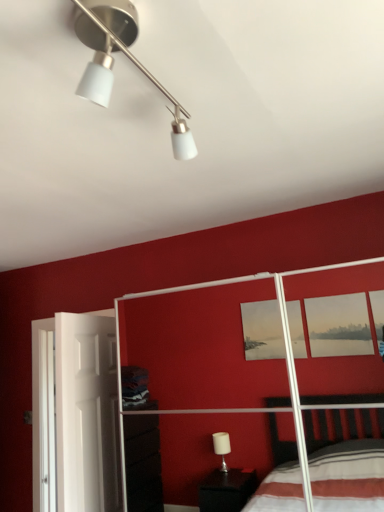
Question: Is matte white bed frame at center smaller than white matte track light at upper center?

Choices:
 (A) yes
 (B) no

Answer: (B)

Question: Is matte white bed frame at center in contact with white matte track light at upper center?

Choices:
 (A) no
 (B) yes

Answer: (A)

Question: Is white matte track light at upper center at the back of matte white bed frame at center?

Choices:
 (A) no
 (B) yes

Answer: (A)

Question: Considering the relative sizes of matte white bed frame at center and white matte track light at upper center in the image provided, is matte white bed frame at center wider than white matte track light at upper center?

Choices:
 (A) yes
 (B) no

Answer: (A)

Question: Considering the relative sizes of matte white bed frame at center and white matte track light at upper center in the image provided, is matte white bed frame at center thinner than white matte track light at upper center?

Choices:
 (A) no
 (B) yes

Answer: (A)

Question: From the image's perspective, is matte white bed frame at center positioned above or below white matte screen door at left?

Choices:
 (A) above
 (B) below

Answer: (A)

Question: Which is correct: matte white bed frame at center is inside white matte screen door at left, or outside of it?

Choices:
 (A) outside
 (B) inside

Answer: (A)

Question: From their relative heights in the image, would you say matte white bed frame at center is taller or shorter than white matte screen door at left?

Choices:
 (A) tall
 (B) short

Answer: (A)

Question: Considering the relative positions of matte white bed frame at center and white matte screen door at left in the image provided, is matte white bed frame at center to the left or to the right of white matte screen door at left?

Choices:
 (A) left
 (B) right

Answer: (B)

Question: Looking at the image, does white matte track light at upper center seem bigger or smaller compared to white matte screen door at left?

Choices:
 (A) small
 (B) big

Answer: (A)

Question: In terms of width, does white matte track light at upper center look wider or thinner when compared to white matte screen door at left?

Choices:
 (A) wide
 (B) thin

Answer: (A)

Question: Considering the positions of white matte track light at upper center and white matte screen door at left in the image, is white matte track light at upper center taller or shorter than white matte screen door at left?

Choices:
 (A) short
 (B) tall

Answer: (A)

Question: Considering the positions of point (107, 70) and point (76, 501), is point (107, 70) closer or farther from the camera than point (76, 501)?

Choices:
 (A) farther
 (B) closer

Answer: (B)

Question: Choose the correct answer: Is matte white bed frame at center inside white matte track light at upper center or outside it?

Choices:
 (A) inside
 (B) outside

Answer: (B)

Question: Visually, is matte white bed frame at center positioned to the left or to the right of white matte track light at upper center?

Choices:
 (A) right
 (B) left

Answer: (A)